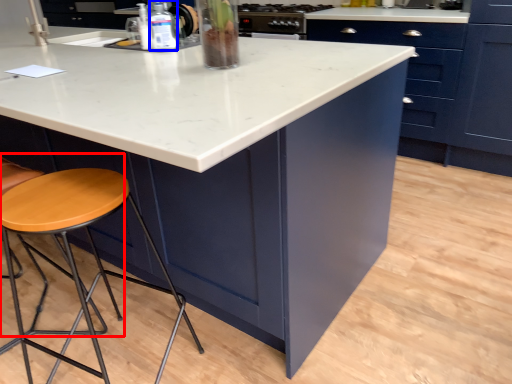
Question: Which of the following is the farthest to the observer, chair (highlighted by a red box) or bottle (highlighted by a blue box)?

Choices:
 (A) chair
 (B) bottle

Answer: (B)